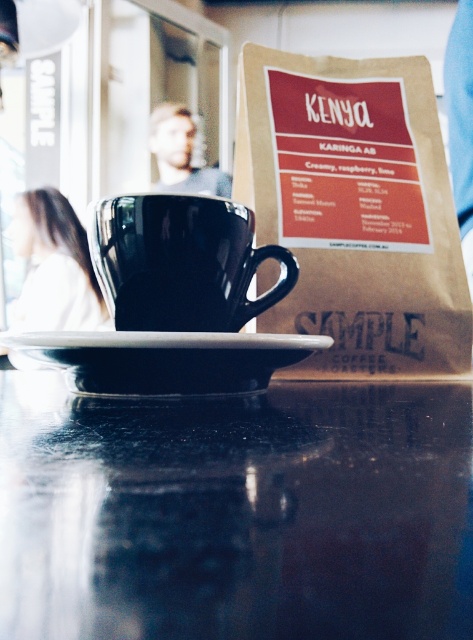
Question: Which object is the farthest from the matte black cup at center?

Choices:
 (A) blonde hair at upper left
 (B) brown paper bag at upper right

Answer: (B)

Question: Among these points, which one is farthest from the camera?

Choices:
 (A) (46, 477)
 (B) (167, 252)
 (C) (172, 168)
 (D) (457, 346)

Answer: (C)

Question: Can you confirm if white glossy saucer at center is positioned above blonde hair at upper left?

Choices:
 (A) no
 (B) yes

Answer: (A)

Question: Can you confirm if brown paper bag at upper right is positioned above white glossy saucer at center?

Choices:
 (A) yes
 (B) no

Answer: (A)

Question: Considering the relative positions of glossy black table at center and blonde hair at upper left in the image provided, where is glossy black table at center located with respect to blonde hair at upper left?

Choices:
 (A) below
 (B) above

Answer: (A)

Question: Which point is closer to the camera?

Choices:
 (A) (159, 300)
 (B) (80, 312)

Answer: (A)